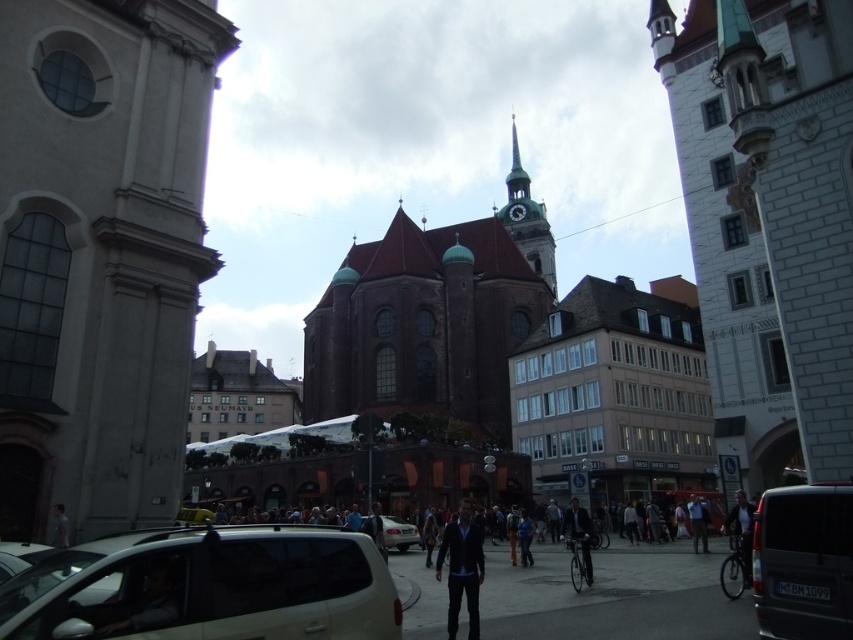
Question: Which of the following is the farthest from the observer?

Choices:
 (A) (254, 560)
 (B) (451, 547)

Answer: (B)

Question: Is the position of dark gray van at lower right more distant than that of brown stone clock tower at center?

Choices:
 (A) yes
 (B) no

Answer: (B)

Question: Based on their relative distances, which object is nearer to the dark gray van at lower right?

Choices:
 (A) white matte van at center
 (B) silver metallic car at center
 (C) brown stone clock tower at center

Answer: (A)

Question: Can you confirm if brown stone church at center is positioned to the left of dark blue jacket at lower right?

Choices:
 (A) no
 (B) yes

Answer: (B)

Question: Is the position of dark blue jacket at lower right less distant than that of dark blue suit at center?

Choices:
 (A) no
 (B) yes

Answer: (B)

Question: Which object is positioned closest to the light blue shirt at center?

Choices:
 (A) brown stone clock tower at center
 (B) dark blue jacket at lower right
 (C) white stone tower at left
 (D) brown stone church at center

Answer: (B)